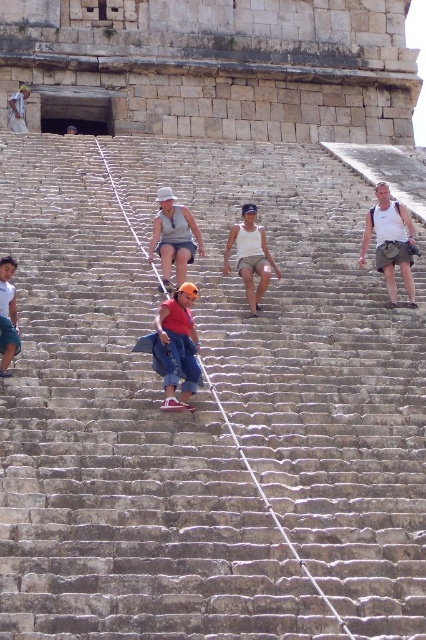
Question: Is matte gray tank top at center smaller than white tank top at center?

Choices:
 (A) no
 (B) yes

Answer: (B)

Question: Which point is farther from the camera taking this photo?

Choices:
 (A) (158, 221)
 (B) (236, 246)

Answer: (A)

Question: Can you confirm if matte gray tank top at center is positioned to the right of white tank top at center?

Choices:
 (A) no
 (B) yes

Answer: (A)

Question: Among these objects, which one is farthest from the camera?

Choices:
 (A) white tank top at center
 (B) matte gray tank top at center

Answer: (A)

Question: In this image, where is matte gray tank top at center located relative to white tank top at center?

Choices:
 (A) right
 (B) left

Answer: (B)